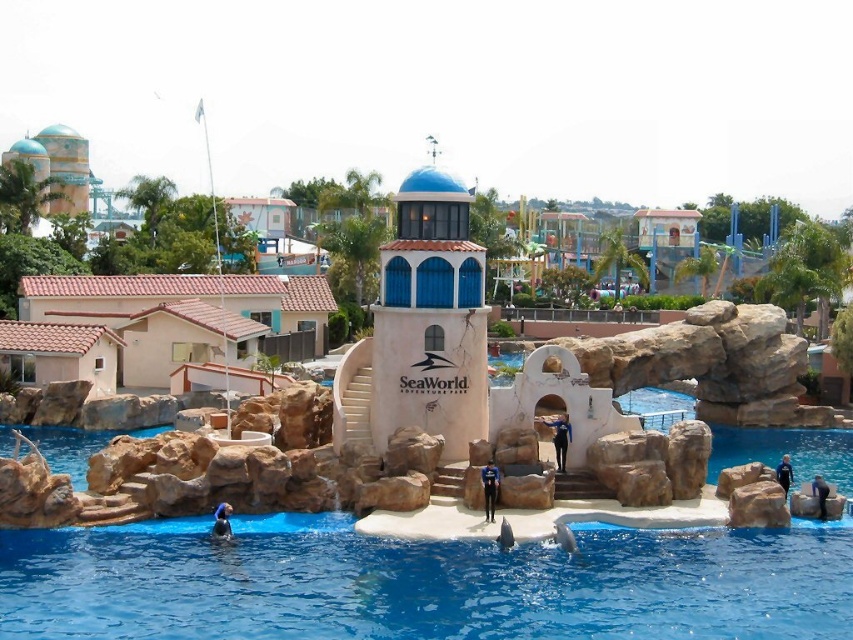
Is blue glossy water at lower center smaller than beige tile roof house at left?

Correct, blue glossy water at lower center occupies less space than beige tile roof house at left.

Does blue glossy water at lower center appear over beige tile roof house at left?

Actually, blue glossy water at lower center is below beige tile roof house at left.

Does point (811, 618) come farther from viewer compared to point (113, 324)?

No, (811, 618) is in front of (113, 324).

This screenshot has height=640, width=853. In order to click on blue glossy water at lower center in this screenshot , I will do `click(425, 586)`.

Is blue painted concrete tower at center bigger than beige tile roof house at left?

Indeed, blue painted concrete tower at center has a larger size compared to beige tile roof house at left.

Find the location of a particular element. The image size is (853, 640). blue painted concrete tower at center is located at coordinates (430, 317).

Who is lower down, blue glossy water at lower center or blue painted concrete tower at center?

blue glossy water at lower center is below.

Who is positioned more to the left, blue glossy water at lower center or blue painted concrete tower at center?

Positioned to the left is blue painted concrete tower at center.

Which is behind, point (265, 582) or point (460, 442)?

Point (460, 442)

The width and height of the screenshot is (853, 640). In order to click on blue glossy water at lower center in this screenshot , I will do `click(425, 586)`.